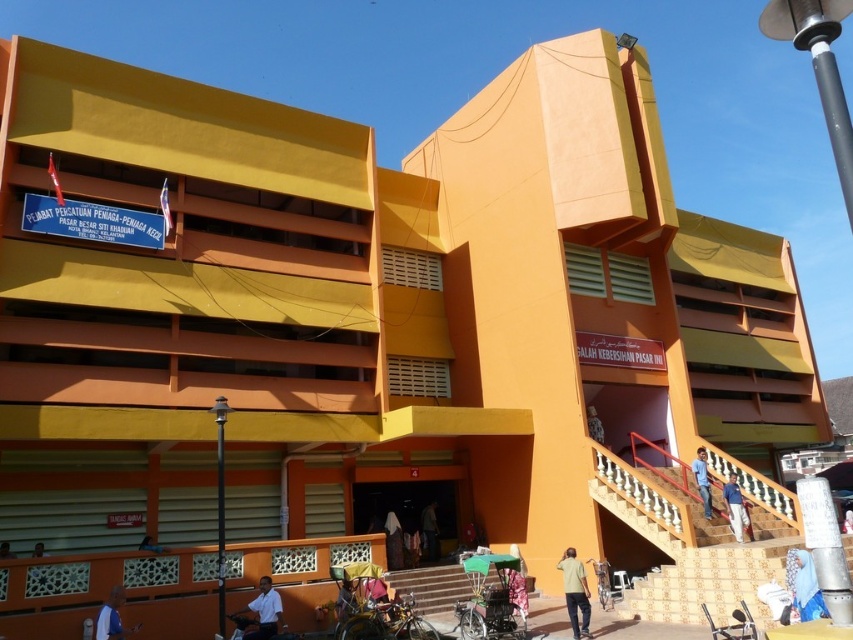
Question: Which point is farther from the camera taking this photo?

Choices:
 (A) (134, 625)
 (B) (48, 572)

Answer: (A)

Question: Which object appears farthest from the camera in this image?

Choices:
 (A) blue fabric pants at upper center
 (B) blue fabric bag at center
 (C) dark brown leather jacket at center
 (D) matte black person at lower left

Answer: (C)

Question: Observing the image, what is the correct spatial positioning of white matte shirt at lower center in reference to light brown wooden chair at center?

Choices:
 (A) below
 (B) above

Answer: (A)

Question: Can you confirm if matte black person at lower left is positioned below dark brown fabric at center?

Choices:
 (A) yes
 (B) no

Answer: (B)

Question: Estimate the real-world distances between objects in this image. Which object is closer to the matte black person at lower left?

Choices:
 (A) blue fabric bag at center
 (B) light yellow shirt at center
 (C) light brown wooden chair at center

Answer: (C)

Question: Does blue fabric bag at center lie in front of dark brown leather jacket at center?

Choices:
 (A) yes
 (B) no

Answer: (A)